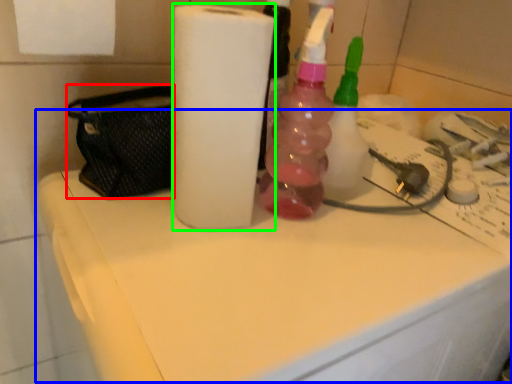
Question: Which object is the closest to the pouch (highlighted by a red box)? Choose among these: counter top (highlighted by a blue box) or paper towel (highlighted by a green box).

Choices:
 (A) counter top
 (B) paper towel

Answer: (B)